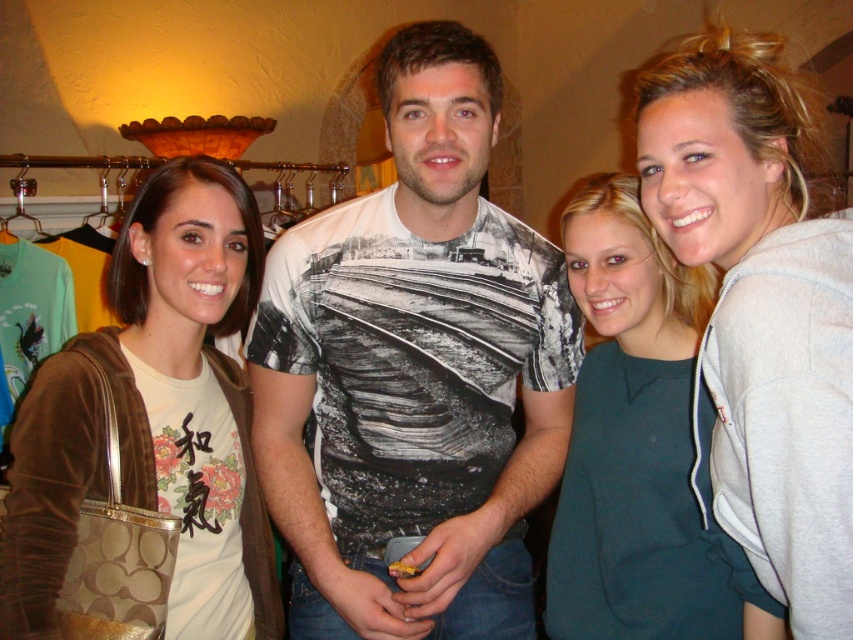
You are taking a photo of the group and want to focus on both the point at (322, 342) and the point at (694, 209). Which point should you focus on first to ensure both are in focus?

You should focus on the point at (322, 342) first because it is closer to the camera than the point at (694, 209). This way, adjusting the focus from near to far will help both points come into focus.